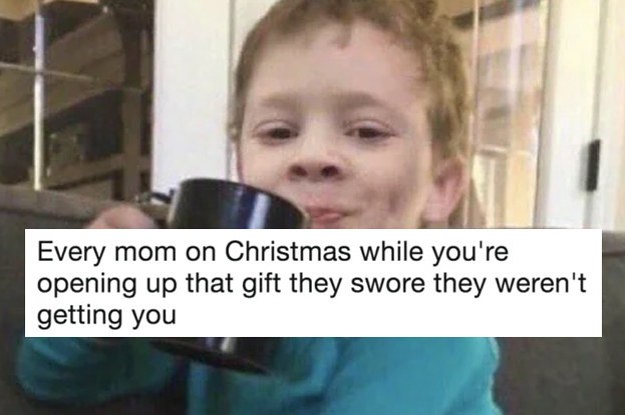
The height and width of the screenshot is (415, 625). I want to click on hinge, so click(592, 163).